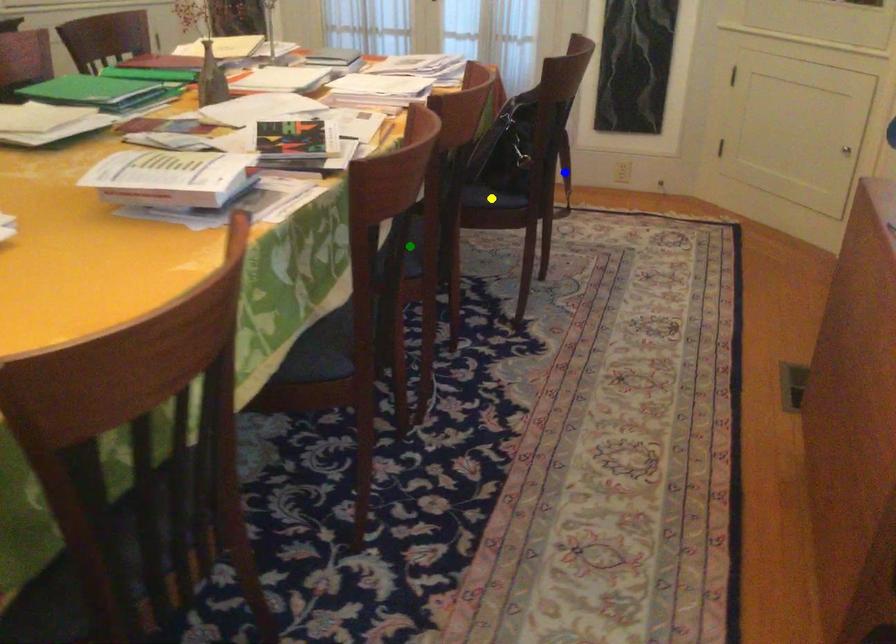
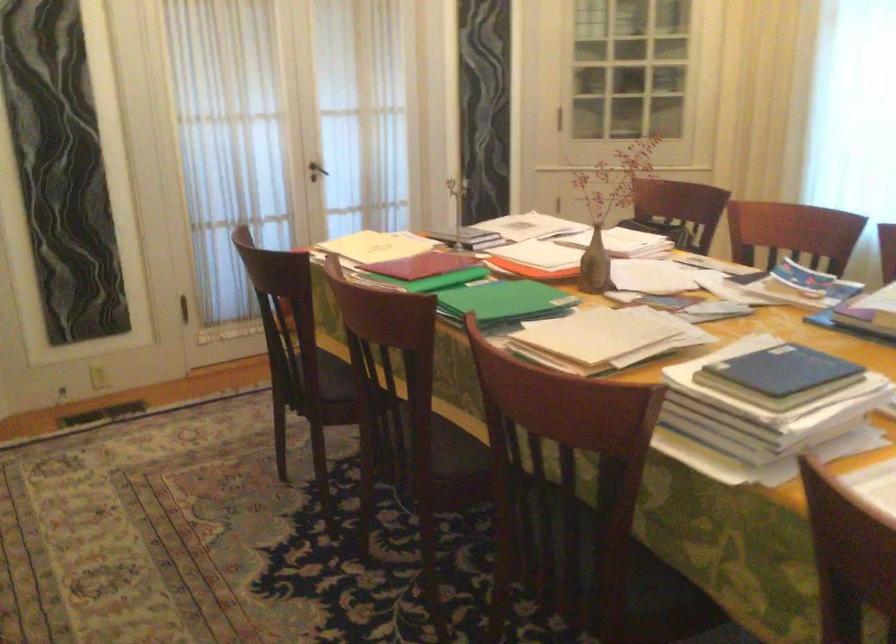
I am providing you with two images of the same scene from different viewpoints. Three points are marked in image1. Which point corresponds to a part or object that is occluded in image2?In image1, three points are marked. Which of them correspond to a part or object that is occluded in image2?Among the three points shown in image1, which one corresponds to a part or object that is no longer visible due to occlusion in image2?

blue point, yellow point, green point cannot be seen in image2.